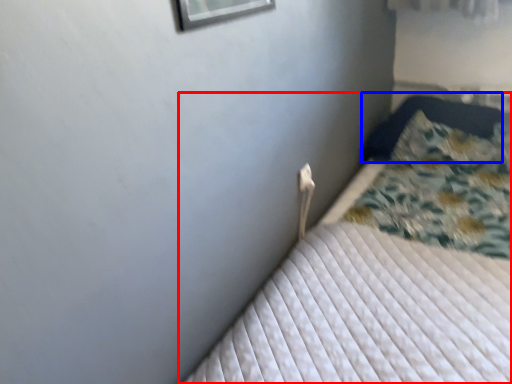
Question: Which of the following is the closest to the observer, bed (highlighted by a red box) or pillow (highlighted by a blue box)?

Choices:
 (A) bed
 (B) pillow

Answer: (A)